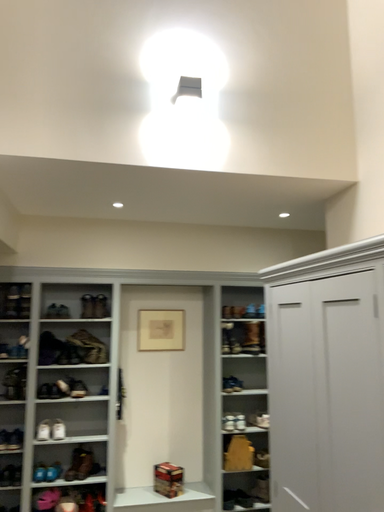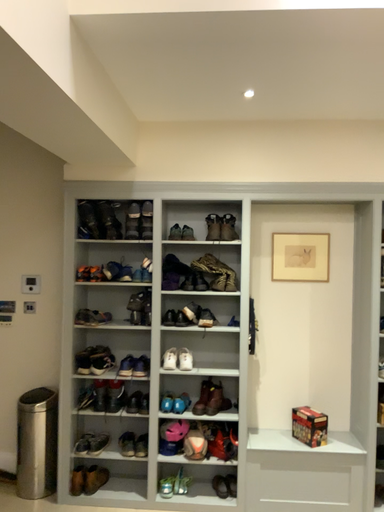
Question: How did the camera likely rotate when shooting the video?

Choices:
 (A) rotated downward
 (B) rotated upward

Answer: (A)